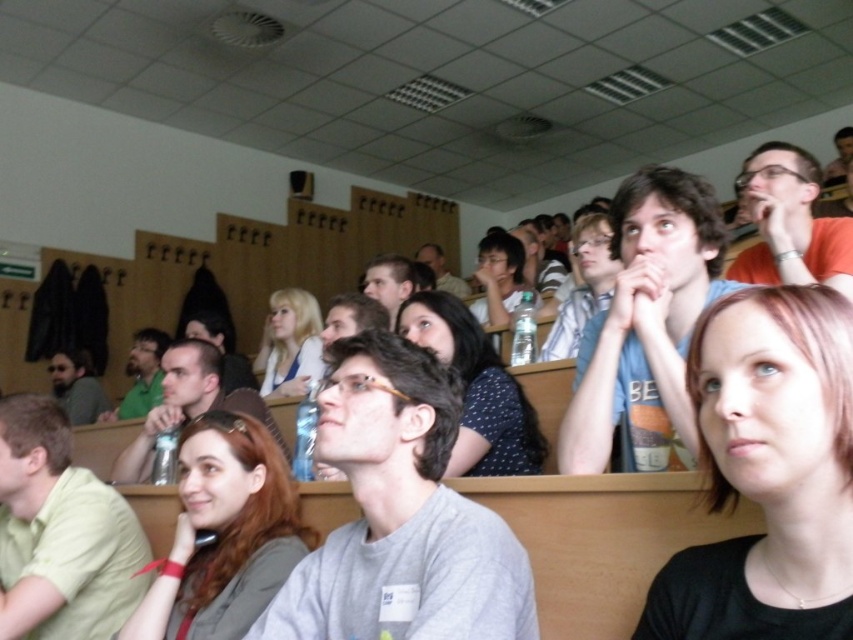
Can you confirm if matte blue shirt at center is shorter than matte brown hair at center?

Answer: No.

Is matte blue shirt at center wider than matte brown hair at center?

Incorrect, matte blue shirt at center's width does not surpass matte brown hair at center's.

Does point (677, 412) come behind point (270, 589)?

No, (677, 412) is closer to viewer.

Locate an element on the screen. matte blue shirt at center is located at coordinates (646, 324).

Does matte brown hair at center appear over blonde hair at center?

Actually, matte brown hair at center is below blonde hair at center.

Is matte brown hair at center thinner than blonde hair at center?

Yes.

Who is more forward, (265,598) or (285,340)?

Point (265,598)

The height and width of the screenshot is (640, 853). Identify the location of matte brown hair at center. (224, 532).

Which of these two, black matte shirt at center or polka dot shirt at center, stands shorter?

black matte shirt at center is shorter.

In the scene shown: Does black matte shirt at center appear over polka dot shirt at center?

Incorrect, black matte shirt at center is not positioned above polka dot shirt at center.

Does point (828, 310) come behind point (488, 413)?

No, it is in front of (488, 413).

Identify the location of black matte shirt at center. (769, 472).